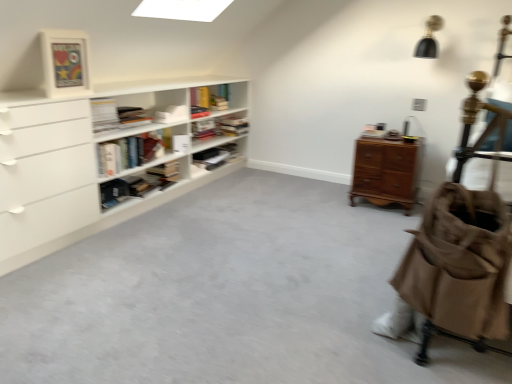
This screenshot has height=384, width=512. What do you see at coordinates (78, 176) in the screenshot?
I see `white matte bookshelf at left, the 1th shelf viewed from the front` at bounding box center [78, 176].

What is the approximate height of hardcover book at center, the fourth book from the top?

hardcover book at center, the fourth book from the top, is 21.19 centimeters in height.

This screenshot has width=512, height=384. Describe the element at coordinates (166, 171) in the screenshot. I see `hardcover book at center, the 1th book when ordered from bottom to top` at that location.

This screenshot has width=512, height=384. Find the location of `white matte bookshelf at center, placed as the 4th book when sorted from bottom to top`. white matte bookshelf at center, placed as the 4th book when sorted from bottom to top is located at coordinates (199, 112).

Measure the distance between white matte bookshelf at center, placed as the 4th book when sorted from bottom to top, and camera.

The distance of white matte bookshelf at center, placed as the 4th book when sorted from bottom to top, from camera is 3.37 meters.

In order to face light brown wooden chest of drawers at right, should I rotate leftwards or rightwards?

You should look right and rotate roughly 16.857 degrees.

What do you see at coordinates (386, 172) in the screenshot? I see `light brown wooden chest of drawers at right` at bounding box center [386, 172].

What is the approximate width of matte black bookshelf at center, acting as the 2th shelf starting from the back?

It is 11.83 inches.

The height and width of the screenshot is (384, 512). In order to click on white matte bookshelf at left, which appears as the third shelf when viewed from the back in this screenshot , I will do `click(78, 176)`.

Is white matte bookshelf at upper center, the 2th book when ordered from top to bottom, oriented towards white matte bookshelf at left, which appears as the third shelf when viewed from the back?

Yes, white matte bookshelf at upper center, the 2th book when ordered from top to bottom, is aimed at white matte bookshelf at left, which appears as the third shelf when viewed from the back.

How many degrees apart are the facing directions of white matte bookshelf at upper center, the 2th book when ordered from top to bottom, and white matte bookshelf at left, which appears as the third shelf when viewed from the back?

There is a 0.357-degree angle between the facing directions of white matte bookshelf at upper center, the 2th book when ordered from top to bottom, and white matte bookshelf at left, which appears as the third shelf when viewed from the back.

Could you measure the distance between white matte bookshelf at upper center, the 2th book when ordered from top to bottom, and white matte bookshelf at left, which appears as the third shelf when viewed from the back?

white matte bookshelf at upper center, the 2th book when ordered from top to bottom, is 23.45 inches from white matte bookshelf at left, which appears as the third shelf when viewed from the back.

In terms of size, does white matte bookshelf at upper center, the 2th book when ordered from top to bottom, appear bigger or smaller than white matte bookshelf at left, which appears as the third shelf when viewed from the back?

In the image, white matte bookshelf at upper center, the 2th book when ordered from top to bottom, appears to be smaller than white matte bookshelf at left, which appears as the third shelf when viewed from the back.

Can you confirm if hardcover book at upper left, the third book positioned from the top, is wider than wooden bookshelf at upper center, placed as the 3th shelf when sorted from front to back?

Incorrect, the width of hardcover book at upper left, the third book positioned from the top, does not surpass that of wooden bookshelf at upper center, placed as the 3th shelf when sorted from front to back.

In terms of height, does hardcover book at upper left, which is the 2th book from bottom to top, look taller or shorter compared to wooden bookshelf at upper center, placed as the 3th shelf when sorted from front to back?

In the image, hardcover book at upper left, which is the 2th book from bottom to top, appears to be shorter than wooden bookshelf at upper center, placed as the 3th shelf when sorted from front to back.

Is hardcover book at upper left, which is the 2th book from bottom to top, positioned with its back to wooden bookshelf at upper center, placed as the 3th shelf when sorted from front to back?

hardcover book at upper left, which is the 2th book from bottom to top, does not have its back to wooden bookshelf at upper center, placed as the 3th shelf when sorted from front to back.

Is hardcover book at upper left, the third book positioned from the top, surrounded by white matte bookshelf at upper center, the 2th book when ordered from top to bottom?

Definitely not — hardcover book at upper left, the third book positioned from the top, is not inside white matte bookshelf at upper center, the 2th book when ordered from top to bottom.

How far apart are white matte bookshelf at upper center, positioned as the third book in bottom-to-top order, and hardcover book at upper left, which is the 2th book from bottom to top?

white matte bookshelf at upper center, positioned as the third book in bottom-to-top order, and hardcover book at upper left, which is the 2th book from bottom to top, are 13.55 inches apart.

In terms of height, does white matte bookshelf at upper center, positioned as the third book in bottom-to-top order, look taller or shorter compared to hardcover book at upper left, the third book positioned from the top?

Considering their sizes, white matte bookshelf at upper center, positioned as the third book in bottom-to-top order, has less height than hardcover book at upper left, the third book positioned from the top.

From a real-world perspective, does white matte bookshelf at upper center, positioned as the third book in bottom-to-top order, stand above hardcover book at upper left, which is the 2th book from bottom to top?

No.

Which is correct: white matte bookshelf at center, placed as the 4th book when sorted from bottom to top, is inside hardcover book at upper left, which is the 2th book from bottom to top, or outside of it?

white matte bookshelf at center, placed as the 4th book when sorted from bottom to top, is located beyond the bounds of hardcover book at upper left, which is the 2th book from bottom to top.

From a real-world perspective, is white matte bookshelf at center, marked as the first book in a top-to-bottom arrangement, physically below hardcover book at upper left, which is the 2th book from bottom to top?

Yes, from a real-world perspective, white matte bookshelf at center, marked as the first book in a top-to-bottom arrangement, is below hardcover book at upper left, which is the 2th book from bottom to top.

Visually, is white matte bookshelf at center, placed as the 4th book when sorted from bottom to top, positioned to the left or to the right of hardcover book at upper left, which is the 2th book from bottom to top?

Clearly, white matte bookshelf at center, placed as the 4th book when sorted from bottom to top, is on the right of hardcover book at upper left, which is the 2th book from bottom to top, in the image.

From the picture: Which is further, (495, 297) or (410, 192)?

The point (410, 192) is farther.

Could you tell me if brown canvas stroller at right is facing light brown wooden chest of drawers at right?

No, brown canvas stroller at right is not facing towards light brown wooden chest of drawers at right.

Does brown canvas stroller at right have a greater height compared to light brown wooden chest of drawers at right?

Yes, brown canvas stroller at right is taller than light brown wooden chest of drawers at right.

In the image, is matte wooden picture frame at upper left on the left side or the right side of brown canvas stroller at right?

In the image, matte wooden picture frame at upper left appears on the left side of brown canvas stroller at right.

Is matte wooden picture frame at upper left located outside brown canvas stroller at right?

That's correct, matte wooden picture frame at upper left is outside of brown canvas stroller at right.

Which of these two, matte wooden picture frame at upper left or brown canvas stroller at right, is bigger?

Bigger between the two is brown canvas stroller at right.

How different are the orientations of matte wooden picture frame at upper left and light brown wooden chest of drawers at right in degrees?

87.1 degrees separate the facing orientations of matte wooden picture frame at upper left and light brown wooden chest of drawers at right.

Could you tell me if matte wooden picture frame at upper left is turned towards light brown wooden chest of drawers at right?

No.

Based on the photo, is matte wooden picture frame at upper left wider than light brown wooden chest of drawers at right?

In fact, matte wooden picture frame at upper left might be narrower than light brown wooden chest of drawers at right.

Considering the positions of point (51, 64) and point (411, 184), is point (51, 64) closer or farther from the camera than point (411, 184)?

Point (51, 64).

Locate an element on the screen. the 2nd book behind the white matte bookshelf at left, which appears as the third shelf when viewed from the back is located at coordinates (172, 114).

Starting from the wooden bookshelf at upper center, placed as the 3th shelf when sorted from front to back, which book is the 4th one to the left? Please provide its 2D coordinates.

[(116, 116)]

From the image, which object appears to be nearer to white matte bookshelf at left, which appears as the third shelf when viewed from the back, white matte bookshelf at center, marked as the first book in a top-to-bottom arrangement, or matte wooden picture frame at upper left?

matte wooden picture frame at upper left is positioned closer to the anchor white matte bookshelf at left, which appears as the third shelf when viewed from the back.

When comparing their distances from hardcover book at center, the 1th book when ordered from bottom to top, does matte black bookshelf at center, acting as the 2th shelf starting from the back, or white matte bookshelf at left, which appears as the third shelf when viewed from the back, seem closer?

The object closer to hardcover book at center, the 1th book when ordered from bottom to top, is matte black bookshelf at center, acting as the 2th shelf starting from the back.

In the scene shown: When comparing their distances from hardcover book at upper left, the third book positioned from the top, does hardcover book at center, the fourth book from the top, or white matte bookshelf at left, which appears as the third shelf when viewed from the back, seem further?

hardcover book at center, the fourth book from the top.

Considering their positions, is light brown wooden chest of drawers at right positioned closer to matte black bookshelf at center, the second shelf when ordered from front to back, than hardcover book at center, the 1th book when ordered from bottom to top?

hardcover book at center, the 1th book when ordered from bottom to top.

When comparing their distances from white matte bookshelf at center, placed as the 4th book when sorted from bottom to top, does white matte bookshelf at upper center, the 2th book when ordered from top to bottom, or white matte bookshelf at left, which appears as the third shelf when viewed from the back, seem further?

Based on the image, white matte bookshelf at left, which appears as the third shelf when viewed from the back, appears to be further to white matte bookshelf at center, placed as the 4th book when sorted from bottom to top.

From the image, which object appears to be farther from light brown wooden chest of drawers at right, white matte bookshelf at center, marked as the first book in a top-to-bottom arrangement, or matte black bookshelf at center, the second shelf when ordered from front to back?

white matte bookshelf at center, marked as the first book in a top-to-bottom arrangement, lies further to light brown wooden chest of drawers at right than the other object.

Based on the photo, looking at the image, which one is located further to white matte bookshelf at upper center, the 2th book when ordered from top to bottom, light brown wooden chest of drawers at right or brown canvas stroller at right?

The object further to white matte bookshelf at upper center, the 2th book when ordered from top to bottom, is brown canvas stroller at right.

Which object lies nearer to the anchor point brown canvas stroller at right, matte wooden picture frame at upper left or hardcover book at center, the 1th book when ordered from bottom to top?

matte wooden picture frame at upper left lies closer to brown canvas stroller at right than the other object.

Image resolution: width=512 pixels, height=384 pixels. Find the location of `shelf between matte wooden picture frame at upper left and wooden bookshelf at upper center, placed as the 3th shelf when sorted from front to back, from front to back`. shelf between matte wooden picture frame at upper left and wooden bookshelf at upper center, placed as the 3th shelf when sorted from front to back, from front to back is located at coordinates (213, 158).

Locate an element on the screen. Image resolution: width=512 pixels, height=384 pixels. shelf between hardcover book at upper left, which is the 2th book from bottom to top, and wooden bookshelf at upper center, the 1th shelf when ordered from back to front, from front to back is located at coordinates (213, 158).

You are a GUI agent. You are given a task and a screenshot of the screen. Output one action in this format:
    pyautogui.click(x=<x>, y=<y>)
    Task: Click on the picture frame between brown canvas stroller at right and white matte bookshelf at center, marked as the first book in a top-to-bottom arrangement, from front to back
    The width and height of the screenshot is (512, 384).
    Given the screenshot: What is the action you would take?
    pyautogui.click(x=65, y=63)

I want to click on picture frame located between white matte bookshelf at left, which appears as the third shelf when viewed from the back, and hardcover book at upper left, which is the 2th book from bottom to top, in the depth direction, so click(65, 63).